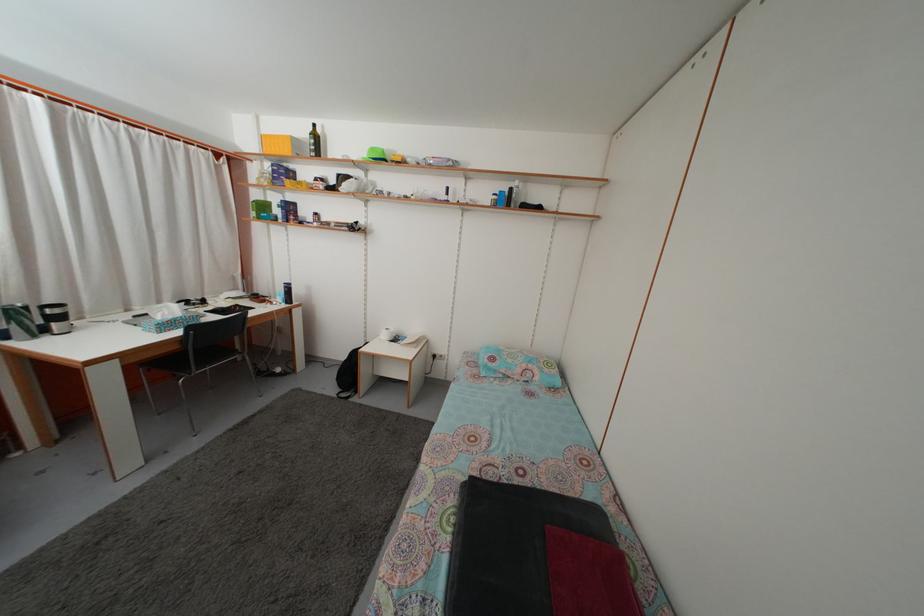
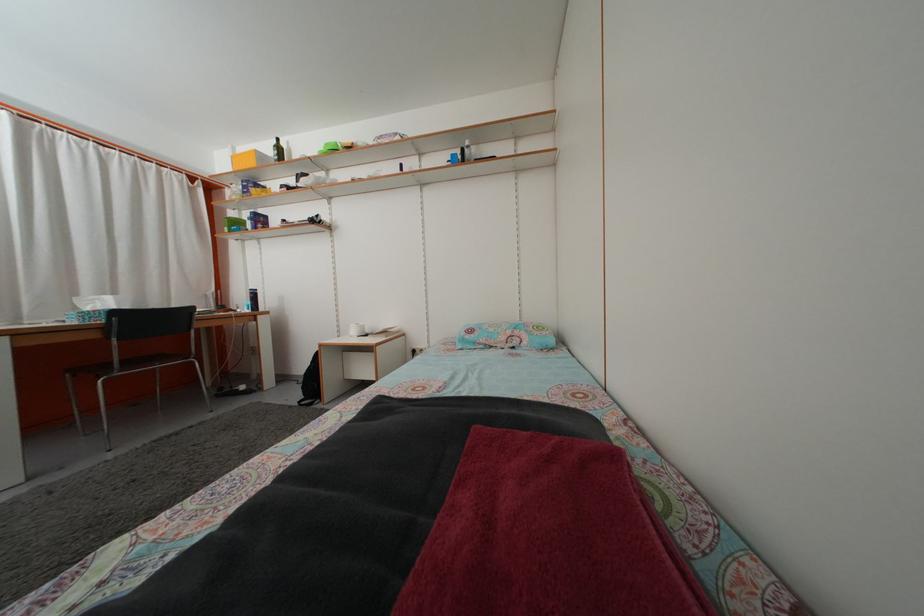
Question: Based on the continuous images, in which direction is the camera rotating? Reply with the corresponding letter.

Choices:
 (A) Left
 (B) Right
 (C) Up
 (D) Down

Answer: (C)